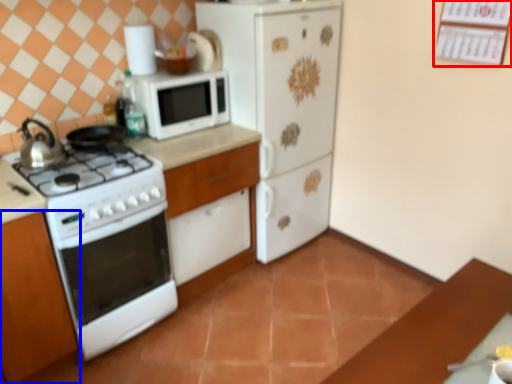
Question: Which of the following is the closest to the observer, bulletin board (highlighted by a red box) or cabinetry (highlighted by a blue box)?

Choices:
 (A) bulletin board
 (B) cabinetry

Answer: (B)